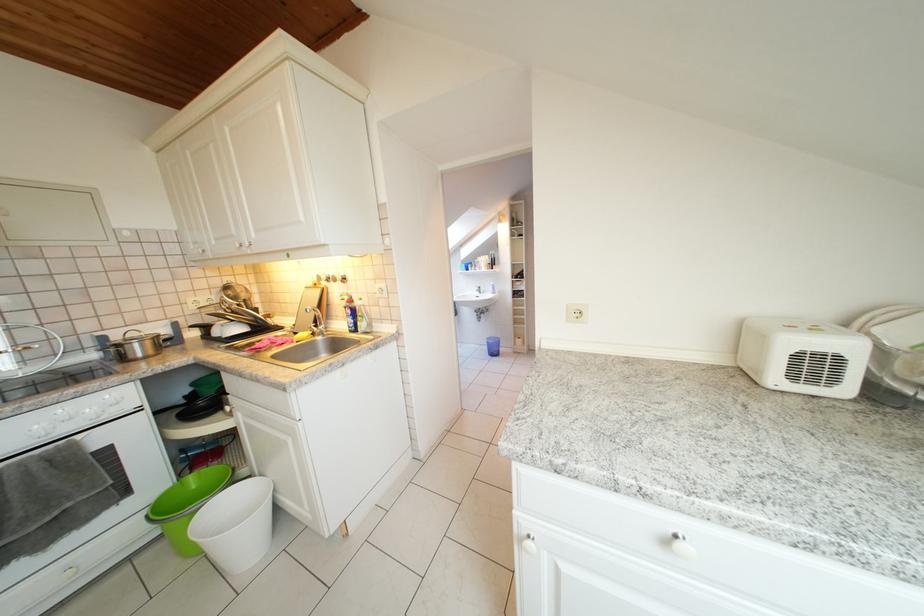
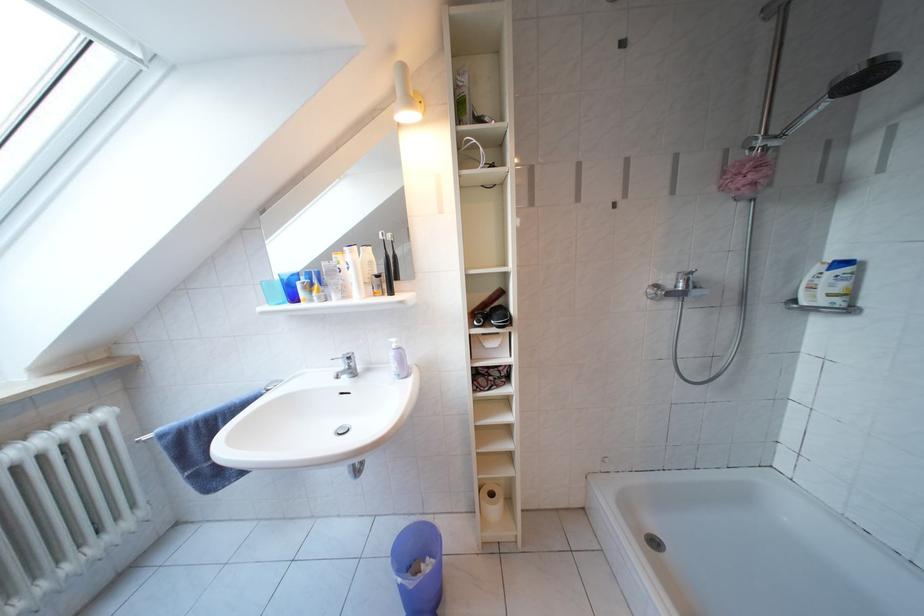
In the second image, find the point that corresponds to point 485,294 in the first image.

(349, 371)